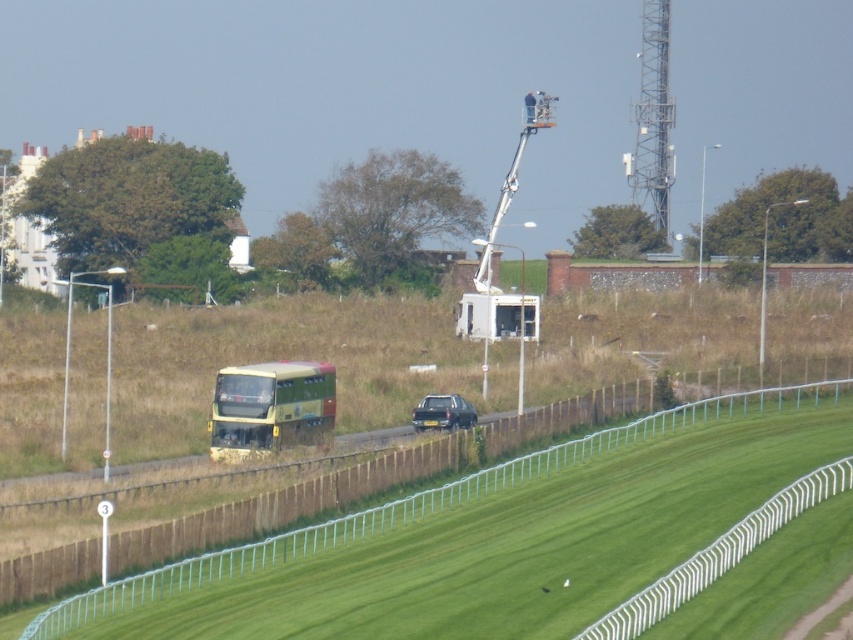
Question: Can you confirm if metallic tower at upper right is positioned above metallic silver car at center?

Choices:
 (A) no
 (B) yes

Answer: (B)

Question: Among these points, which one is nearest to the camera?

Choices:
 (A) (651, 100)
 (B) (270, 384)

Answer: (B)

Question: Which object is farther from the camera taking this photo?

Choices:
 (A) metallic tower at upper right
 (B) metallic silver car at center

Answer: (A)

Question: Does yellow-green metallic bus at center-left appear on the left side of metallic tower at upper right?

Choices:
 (A) yes
 (B) no

Answer: (A)

Question: Is metallic tower at upper right thinner than metallic silver car at center?

Choices:
 (A) yes
 (B) no

Answer: (B)

Question: Among these objects, which one is nearest to the camera?

Choices:
 (A) metallic silver car at center
 (B) yellow-green metallic bus at center-left

Answer: (B)